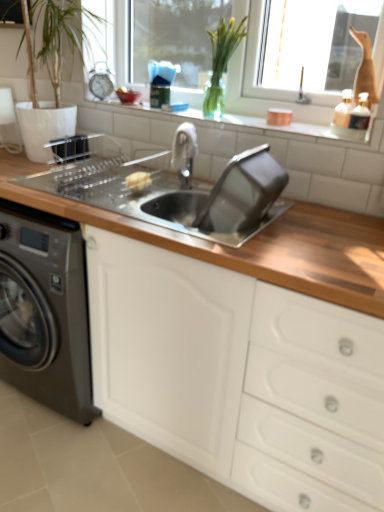
Question: From the image's perspective, is green glass vase at upper center under white plastic window frame at upper center?

Choices:
 (A) no
 (B) yes

Answer: (B)

Question: Considering the relative sizes of green glass vase at upper center and white plastic window frame at upper center in the image provided, is green glass vase at upper center smaller than white plastic window frame at upper center?

Choices:
 (A) yes
 (B) no

Answer: (A)

Question: Is green glass vase at upper center shorter than white plastic window frame at upper center?

Choices:
 (A) no
 (B) yes

Answer: (B)

Question: Would you say green glass vase at upper center contains white plastic window frame at upper center?

Choices:
 (A) no
 (B) yes

Answer: (A)

Question: Is green glass vase at upper center touching white plastic window frame at upper center?

Choices:
 (A) yes
 (B) no

Answer: (B)

Question: Are green glass vase at upper center and white plastic window frame at upper center far apart?

Choices:
 (A) yes
 (B) no

Answer: (B)

Question: Is white glossy tile at upper center facing away from green glass vase at upper center?

Choices:
 (A) yes
 (B) no

Answer: (B)

Question: Can you confirm if white glossy tile at upper center is taller than green glass vase at upper center?

Choices:
 (A) yes
 (B) no

Answer: (B)

Question: Can we say white glossy tile at upper center lies outside green glass vase at upper center?

Choices:
 (A) yes
 (B) no

Answer: (A)

Question: Is white glossy tile at upper center to the right of green glass vase at upper center from the viewer's perspective?

Choices:
 (A) yes
 (B) no

Answer: (B)

Question: Can you see white glossy tile at upper center touching green glass vase at upper center?

Choices:
 (A) no
 (B) yes

Answer: (A)

Question: Can you confirm if white glossy tile at upper center is shorter than green glass vase at upper center?

Choices:
 (A) no
 (B) yes

Answer: (B)

Question: Is wooden countertop at center wider than white plastic window frame at upper center?

Choices:
 (A) no
 (B) yes

Answer: (B)